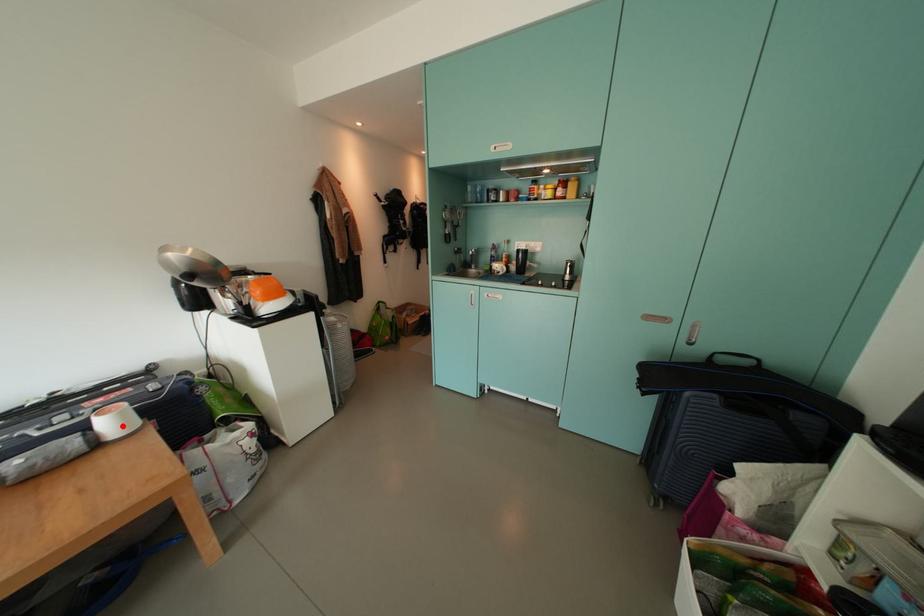
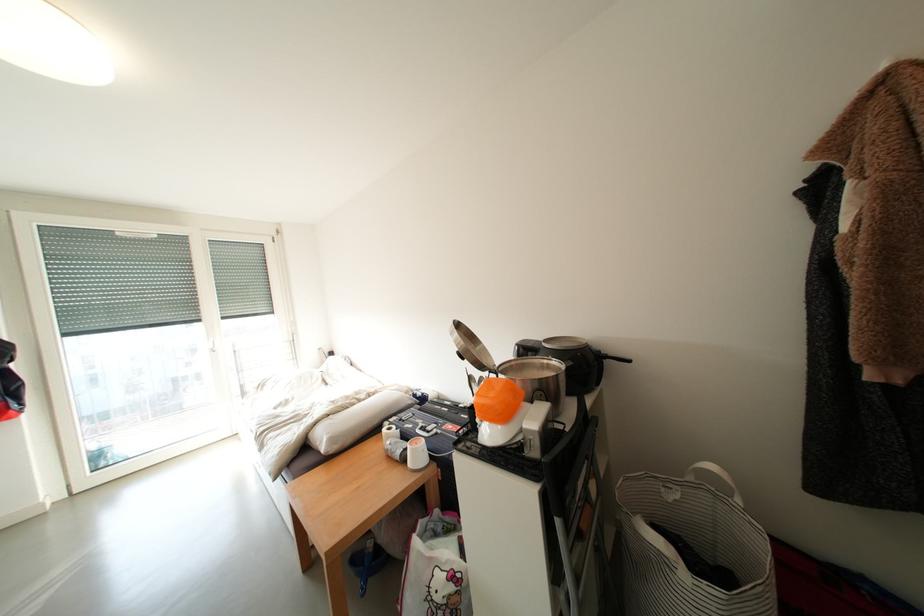
In the second image, find the point that corresponds to the highlighted location in the first image.

(424, 456)